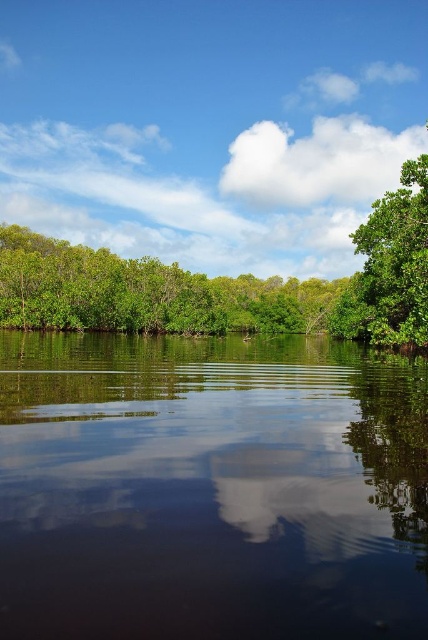
You are standing at the center of the image and want to locate the green leafy trees at left. According to the coordinates provided, in which direction should you look to find them?

The green leafy trees at left are located at coordinates point (x=145, y=292), so you should look to the left side of the image to find them.

You are a bird flying over the serene landscape. You see the green leafy trees at left and the green matte tree at right. Which one is positioned higher in the sky?

The green leafy trees at left is located above the green matte tree at right, so it is positioned higher in the sky.